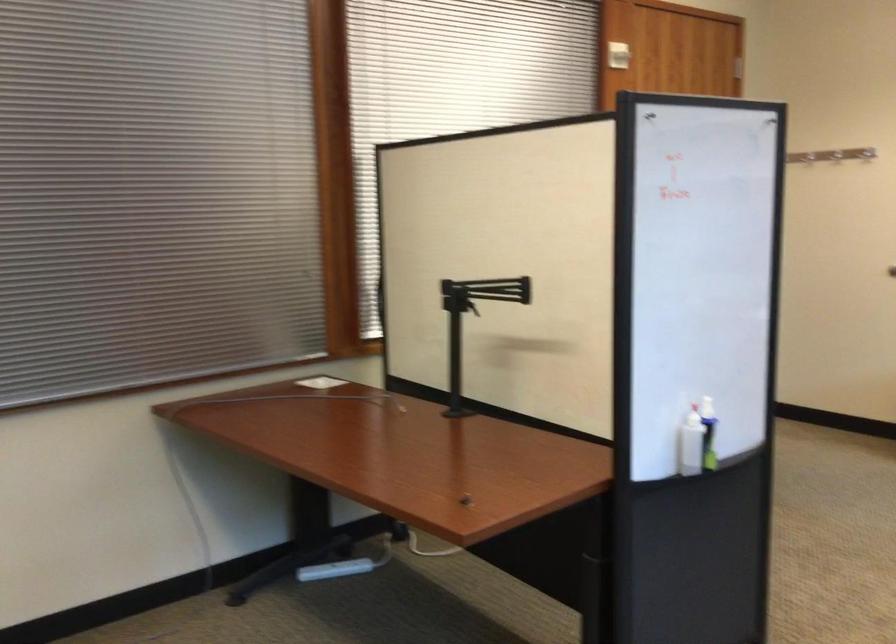
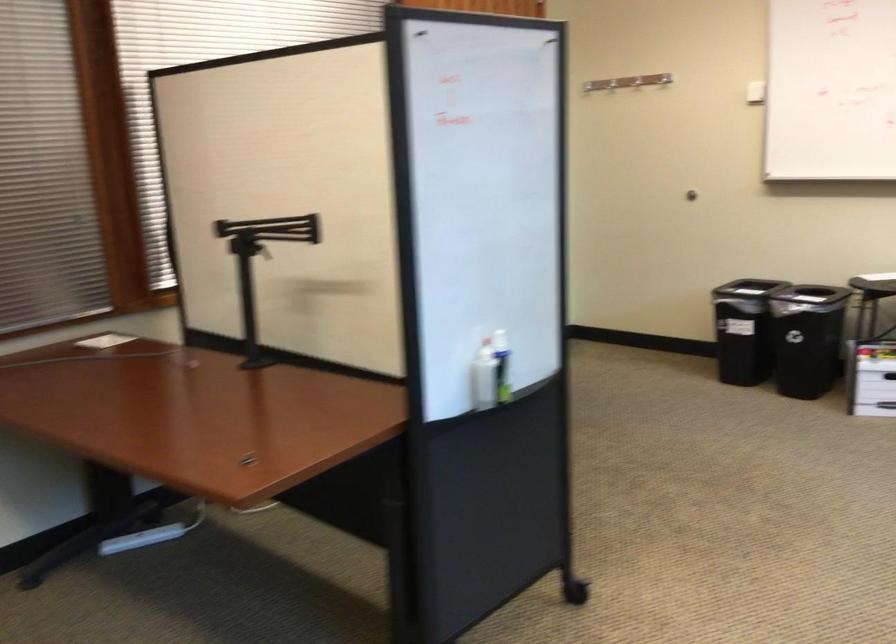
In the second image, find the point that corresponds to [334,573] in the first image.

(141, 538)